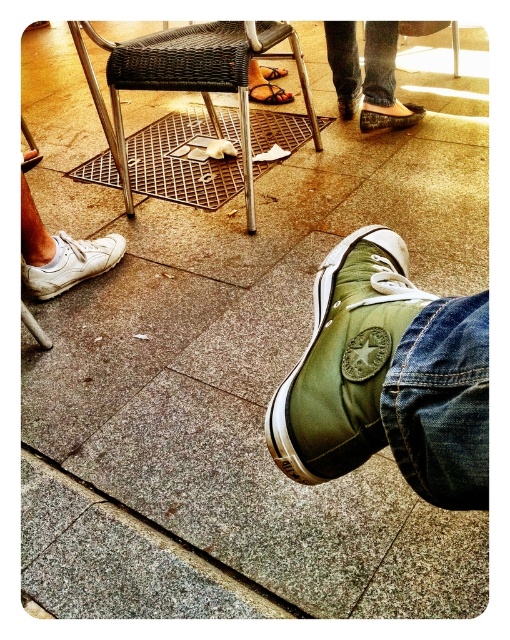
You are a person who is 1.7 meters tall. You see the woven wicker chair at center and the green canvas shoe at center in the image. If you want to sit on the chair, would you need to step over the shoe?

The woven wicker chair at center is taller than the green canvas shoe at center. Since the chair is taller, you would not need to step over the shoe to sit on the chair.

You are standing in the outdoor space and want to place a small potted plant between the two points marked as point (53, 260) and point (413, 109). Since the plant needs to be closer to the person with the olive green Converse sneakers, which point should you place it near?

You should place the plant near point (53, 260) because it is closer to the viewer, and since the person with the olive green Converse sneakers is in the foreground, this placement would position the plant nearer to them.